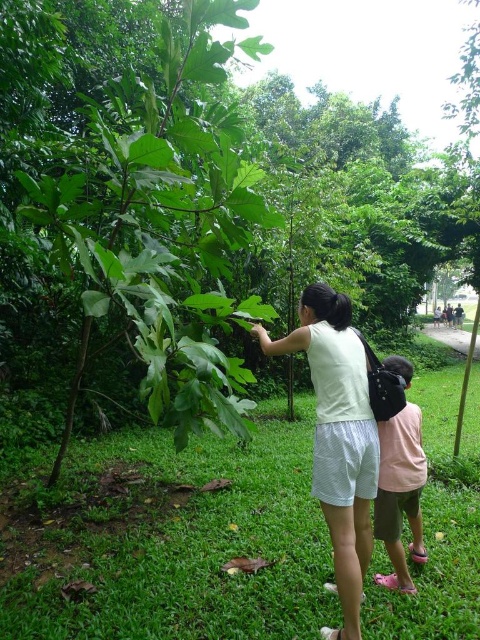
Does green grass at lower center have a greater width compared to white cotton shirt at center?

Yes, green grass at lower center is wider than white cotton shirt at center.

Looking at this image, is green grass at lower center bigger than white cotton shirt at center?

Actually, green grass at lower center might be smaller than white cotton shirt at center.

You are a GUI agent. You are given a task and a screenshot of the screen. Output one action in this format:
    pyautogui.click(x=<x>, y=<y>)
    Task: Click on the green grass at lower center
    
    Given the screenshot: What is the action you would take?
    pyautogui.click(x=177, y=544)

What are the coordinates of `green grass at lower center` in the screenshot? It's located at (177, 544).

Does green leafy tree at center come in front of white cotton shirt at center?

No, it is not.

Which is behind, point (260, 202) or point (264, 348)?

Positioned behind is point (260, 202).

The height and width of the screenshot is (640, 480). In order to click on green leafy tree at center in this screenshot , I will do `click(159, 224)`.

Which is in front, point (364, 458) or point (381, 468)?

Point (364, 458) is in front.

Does white cotton shirt at center have a greater width compared to pink fabric shirt at center?

Yes, white cotton shirt at center is wider than pink fabric shirt at center.

Between point (350, 460) and point (420, 420), which one is positioned in front?

Positioned in front is point (350, 460).

What are the coordinates of `white cotton shirt at center` in the screenshot? It's located at (337, 436).